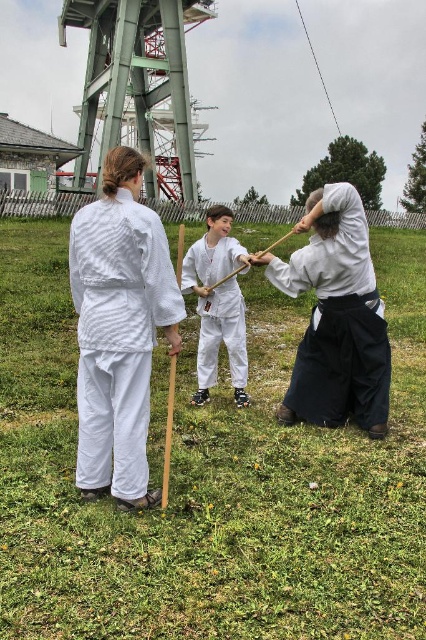
Can you confirm if white cotton kimono at center is positioned to the left of white matte uniform at center?

No, white cotton kimono at center is not to the left of white matte uniform at center.

Does white cotton kimono at center have a greater height compared to white matte uniform at center?

No, white cotton kimono at center is not taller than white matte uniform at center.

Locate an element on the screen. The image size is (426, 640). white cotton kimono at center is located at coordinates (336, 321).

Who is more forward, (91, 284) or (279, 273)?

Positioned in front is point (91, 284).

Image resolution: width=426 pixels, height=640 pixels. What do you see at coordinates (118, 337) in the screenshot?
I see `white woven kimono at center` at bounding box center [118, 337].

Where is `white woven kimono at center`? The image size is (426, 640). white woven kimono at center is located at coordinates click(118, 337).

At what (x,y) coordinates should I click in order to perform the action: click on white woven kimono at center. Please return your answer as a coordinate pair (x, y). The image size is (426, 640). Looking at the image, I should click on (118, 337).

Can you confirm if white woven kimono at center is positioned to the right of white matte uniform at center?

In fact, white woven kimono at center is to the left of white matte uniform at center.

Is white woven kimono at center smaller than white matte uniform at center?

Indeed, white woven kimono at center has a smaller size compared to white matte uniform at center.

Based on the photo, who is more distant from viewer, (164,273) or (241,301)?

Positioned behind is point (241,301).

Identify the location of white woven kimono at center. The width and height of the screenshot is (426, 640). (118, 337).